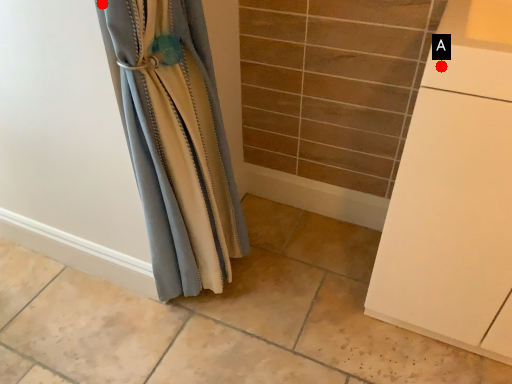
Question: Two points are circled on the image, labeled by A and B beside each circle. Which of the following is the closest to the observer?

Choices:
 (A) A is closer
 (B) B is closer

Answer: (A)